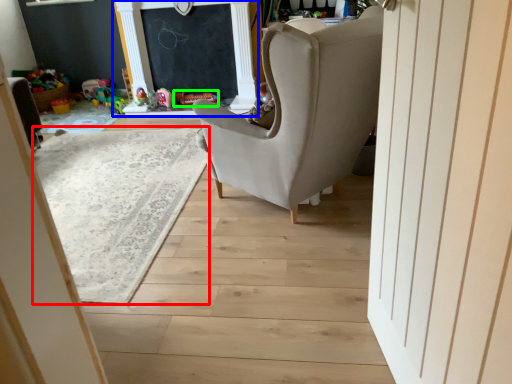
Question: Based on their relative distances, which object is nearer to plain (highlighted by a red box)? Choose from fireplace (highlighted by a blue box) and toy (highlighted by a green box).

Choices:
 (A) fireplace
 (B) toy

Answer: (A)